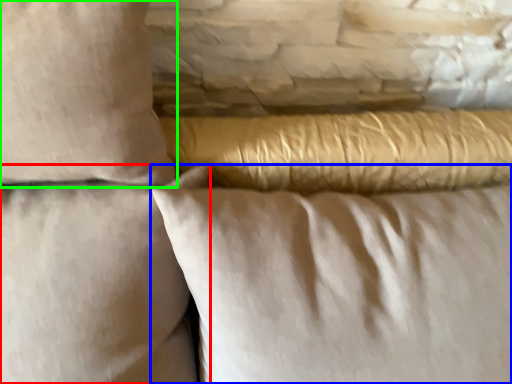
Question: Which object is positioned farthest from pillow (highlighted by a red box)? Select from pillow (highlighted by a blue box) and pillow (highlighted by a green box).

Choices:
 (A) pillow
 (B) pillow

Answer: (A)